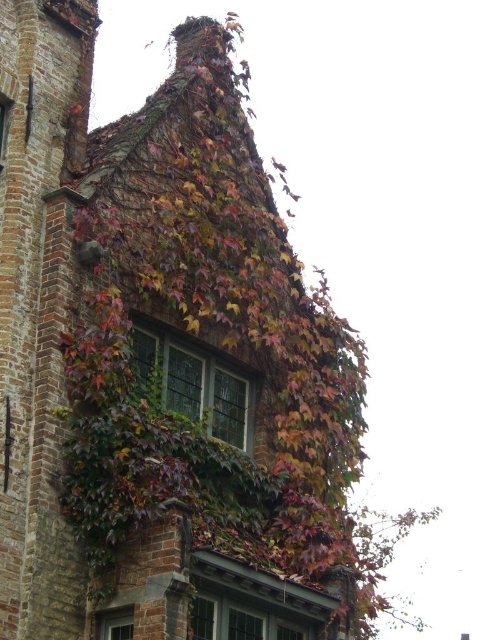
You are an architect assessing the building. You notice the stained glass window at center and the clear glass window at lower left. Which window has a larger surface area?

The stained glass window at center has a larger surface area than the clear glass window at lower left because it is bigger according to the description.